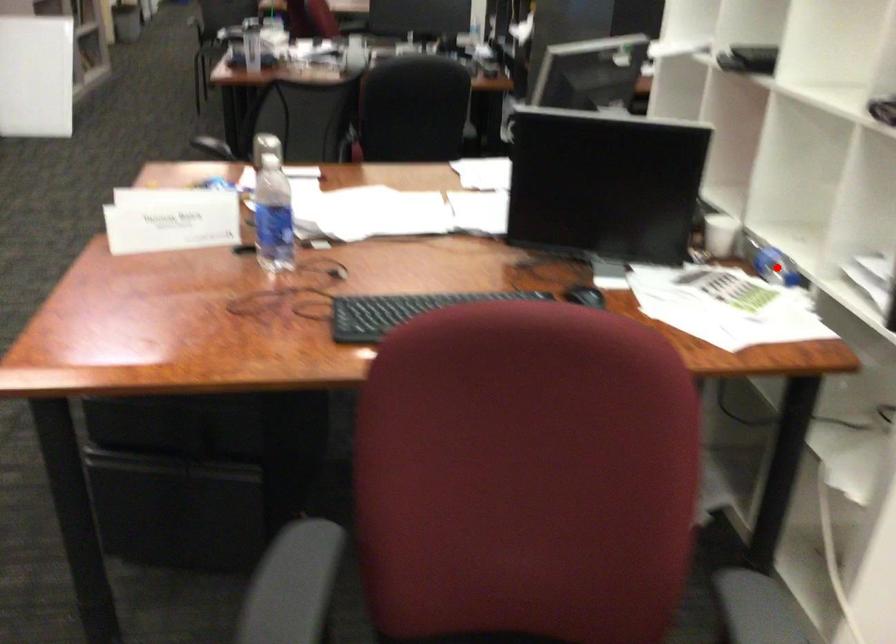
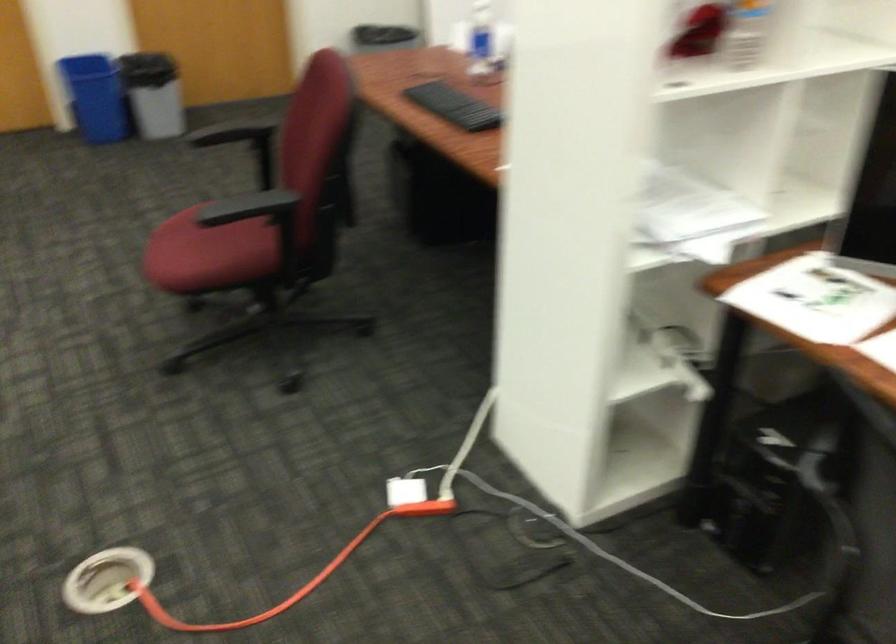
Question: I am providing you with two images of the same scene from different viewpoints. A red point is marked on the first image. Is the red point's position out of view in image 2?

Choices:
 (A) Yes
 (B) No

Answer: (A)